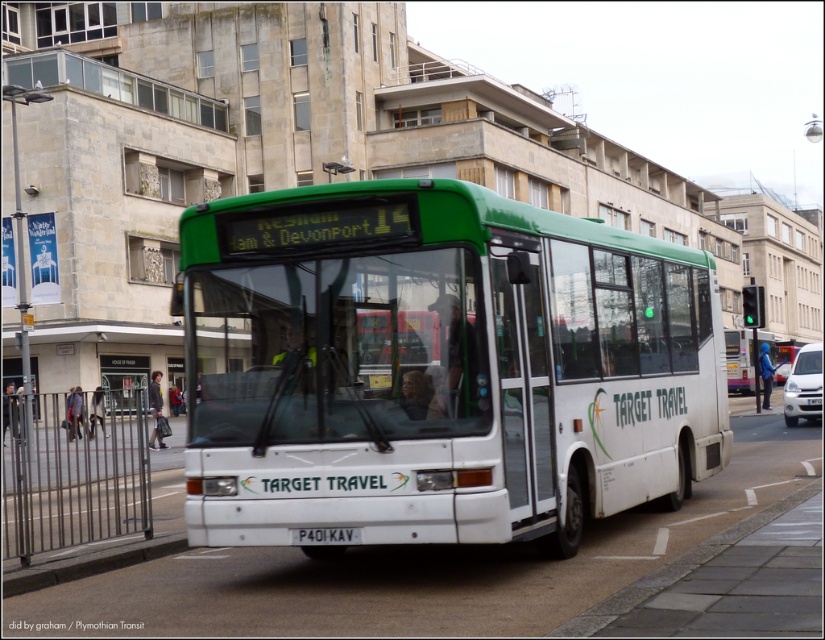
Question: Can you confirm if white matte bus at center is positioned to the right of black plastic license plate at center?

Choices:
 (A) yes
 (B) no

Answer: (A)

Question: Which point appears closest to the camera in this image?

Choices:
 (A) (682, 417)
 (B) (304, 532)

Answer: (B)

Question: Observing the image, what is the correct spatial positioning of white matte bus at center in reference to black plastic license plate at center?

Choices:
 (A) left
 (B) right

Answer: (B)

Question: Which object appears closest to the camera in this image?

Choices:
 (A) black plastic license plate at center
 (B) white matte bus at center

Answer: (B)

Question: Can you confirm if white matte bus at center is positioned to the left of black plastic license plate at center?

Choices:
 (A) no
 (B) yes

Answer: (A)

Question: Which of the following is the closest to the observer?

Choices:
 (A) black plastic license plate at center
 (B) white matte bus at center

Answer: (B)